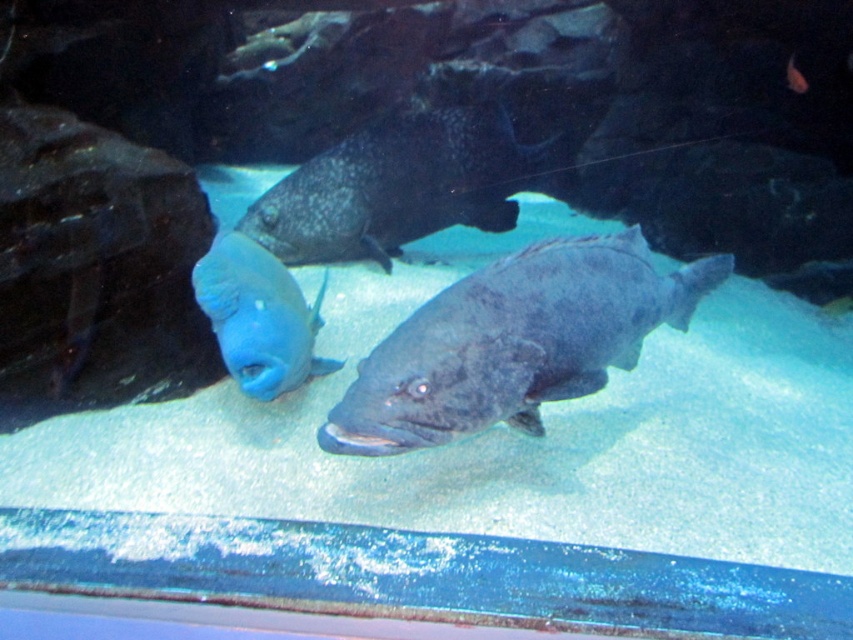
Question: Which of the following is the farthest from the observer?

Choices:
 (A) (621, 344)
 (B) (273, 204)

Answer: (B)

Question: Based on their relative distances, which object is nearer to the shiny dark gray fish at center?

Choices:
 (A) dark gray textured fish at center
 (B) matte blue fish at center

Answer: (B)

Question: Is dark gray textured fish at center thinner than matte blue fish at center?

Choices:
 (A) yes
 (B) no

Answer: (B)

Question: Which object appears closest to the camera in this image?

Choices:
 (A) matte blue fish at center
 (B) shiny dark gray fish at center
 (C) dark gray textured fish at center

Answer: (B)

Question: Does shiny dark gray fish at center have a smaller size compared to dark gray textured fish at center?

Choices:
 (A) yes
 (B) no

Answer: (A)

Question: Is shiny dark gray fish at center closer to camera compared to dark gray textured fish at center?

Choices:
 (A) no
 (B) yes

Answer: (B)